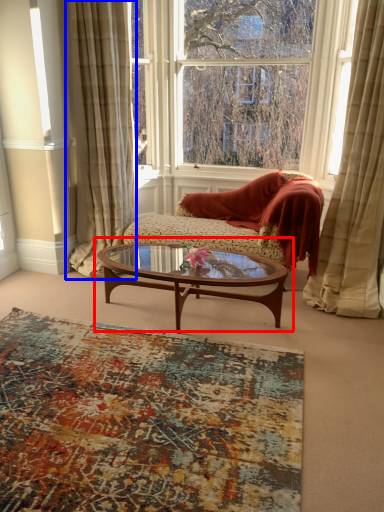
Question: Which object appears closest to the camera in this image, coffee table (highlighted by a red box) or curtain (highlighted by a blue box)?

Choices:
 (A) coffee table
 (B) curtain

Answer: (A)